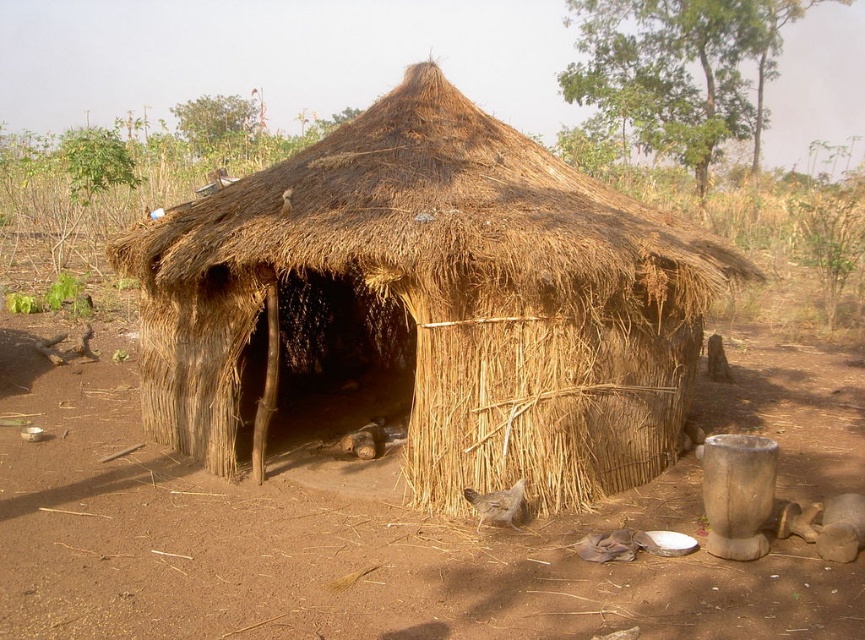
Question: Is brown thatch hut at center closer to the viewer compared to gray feathered chicken at lower center?

Choices:
 (A) no
 (B) yes

Answer: (B)

Question: Can you confirm if brown dirt field at center is positioned below gray feathered chicken at lower center?

Choices:
 (A) no
 (B) yes

Answer: (A)

Question: Which point appears closest to the camera in this image?

Choices:
 (A) (445, 614)
 (B) (498, 499)

Answer: (A)

Question: Estimate the real-world distances between objects in this image. Which object is closer to the gray feathered chicken at lower center?

Choices:
 (A) brown thatch hut at center
 (B) brown dirt field at center

Answer: (A)

Question: Which point appears farthest from the camera in this image?

Choices:
 (A) (29, 413)
 (B) (466, 493)

Answer: (A)

Question: Can you confirm if brown dirt field at center is thinner than gray feathered chicken at lower center?

Choices:
 (A) yes
 (B) no

Answer: (B)